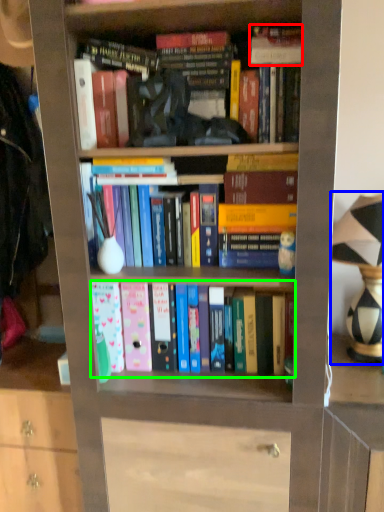
Question: Estimate the real-world distances between objects in this image. Which object is farther from book (highlighted by a red box), table lamp (highlighted by a blue box) or book (highlighted by a green box)?

Choices:
 (A) table lamp
 (B) book

Answer: (B)